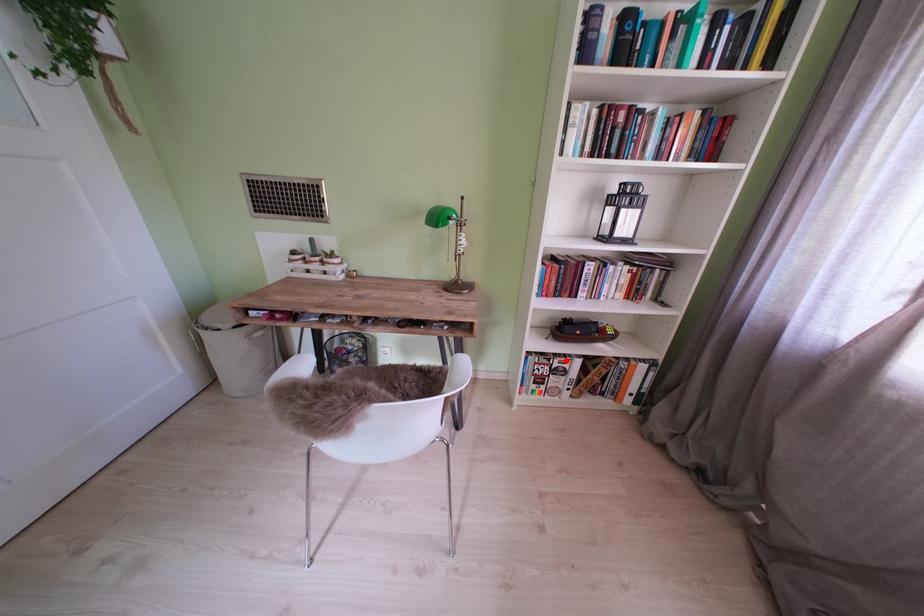
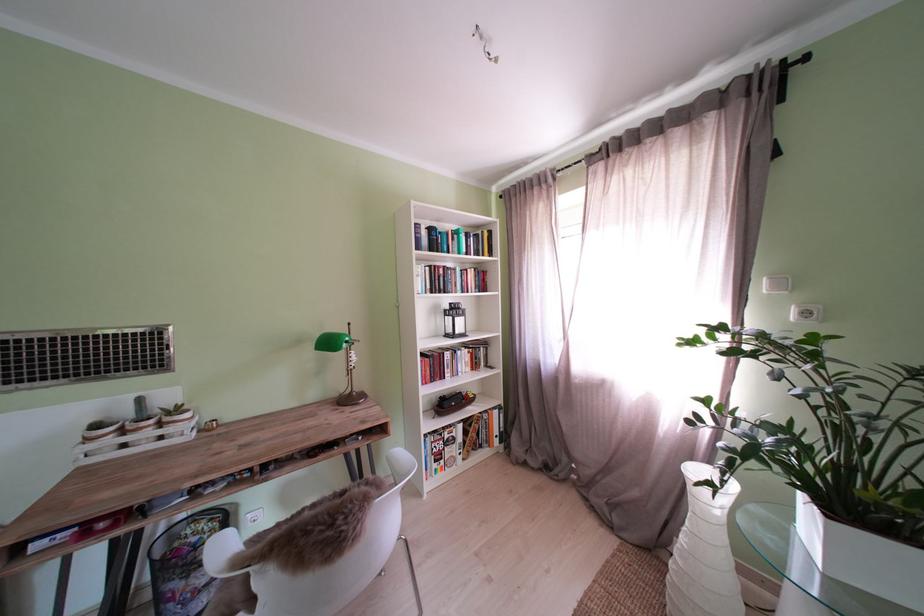
Question: I am providing you with two images of the same scene from different viewpoints. Image1 has a red point marked. In image2, the corresponding 3D location appears at what relative position? Reply with the corresponding letter.

Choices:
 (A) Closer
 (B) Farther

Answer: (B)